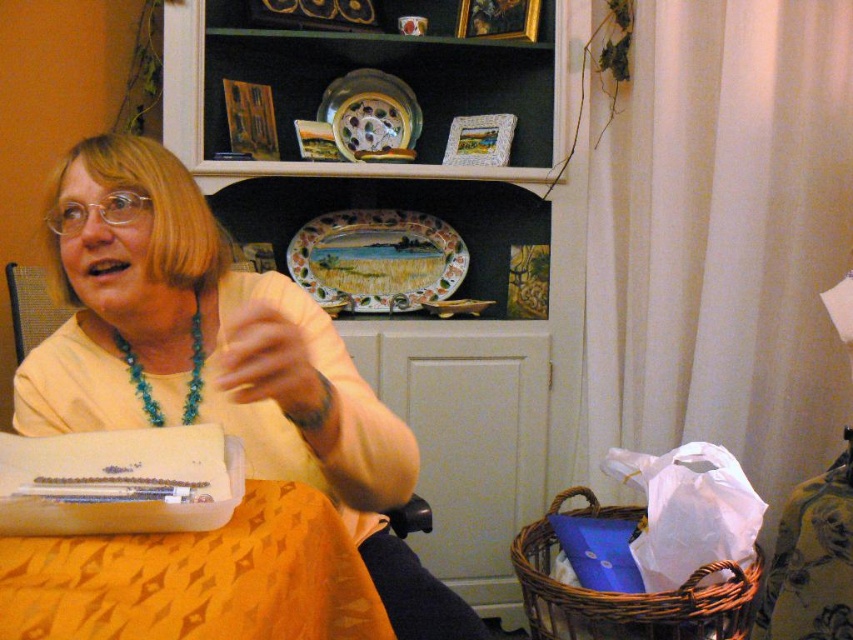
Question: Among these objects, which one is nearest to the camera?

Choices:
 (A) turquoise beaded necklace at upper left
 (B) yellow fabric table at lower left
 (C) yellow matte sweater at center
 (D) smooth skin at center

Answer: (B)

Question: Estimate the real-world distances between objects in this image. Which object is closer to the turquoise beaded necklace at upper left?

Choices:
 (A) yellow fabric table at lower left
 (B) metallic mesh chair at left

Answer: (A)

Question: Can you confirm if matte ceramic plate at upper center is positioned to the left of metallic mesh chair at left?

Choices:
 (A) yes
 (B) no

Answer: (B)

Question: Does matte ceramic plate at upper center appear over metallic mesh chair at left?

Choices:
 (A) no
 (B) yes

Answer: (B)

Question: Which object is closer to the camera taking this photo?

Choices:
 (A) yellow fabric table at lower left
 (B) glazed ceramic platter at upper center
 (C) metallic mesh chair at left
 (D) yellow matte sweater at center

Answer: (A)

Question: Does metallic mesh chair at left appear on the left side of turquoise beaded necklace at upper left?

Choices:
 (A) no
 (B) yes

Answer: (B)